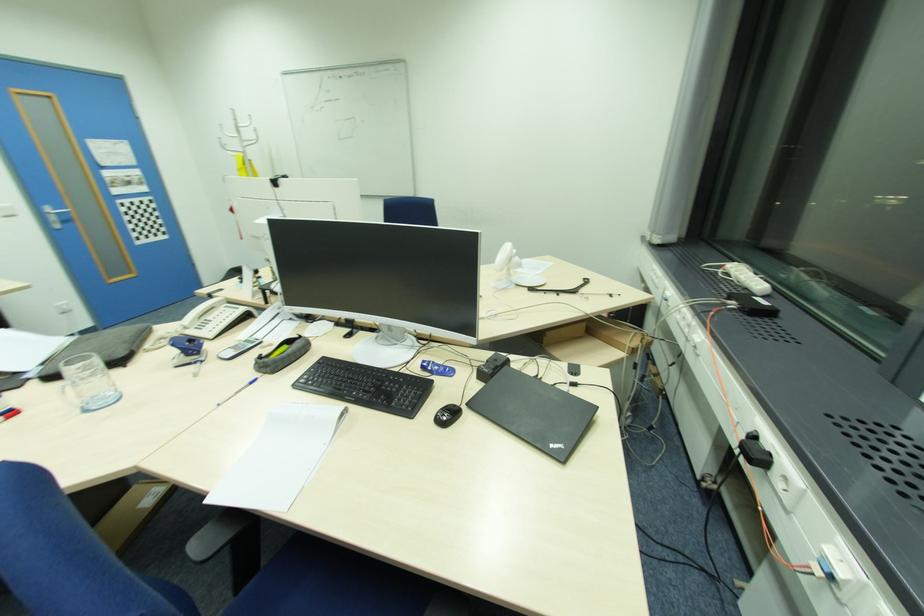
The width and height of the screenshot is (924, 616). Describe the element at coordinates (446, 415) in the screenshot. I see `a black computer mouse` at that location.